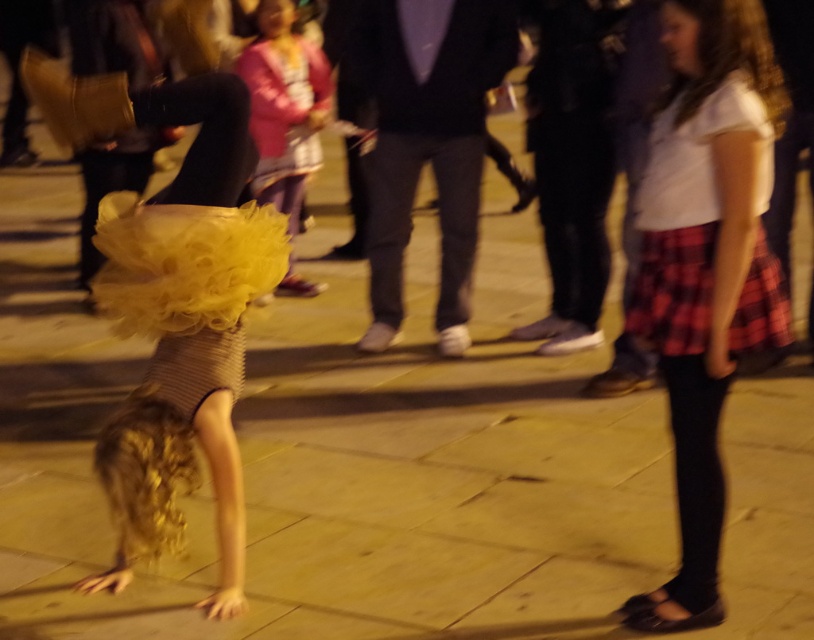
Who is more forward, (710, 488) or (768, 275)?

Point (768, 275) is in front.

Is white cotton shirt at upper right positioned in front of red plaid skirt at right?

Yes, it is in front of red plaid skirt at right.

Identify the location of white cotton shirt at upper right. (705, 268).

Between dark blue suit at center and red plaid skirt at right, which one is positioned higher?

Positioned higher is dark blue suit at center.

The height and width of the screenshot is (640, 814). Identify the location of dark blue suit at center. (427, 140).

Does point (414, 138) lie behind point (764, 307)?

Yes, it is behind point (764, 307).

Where is `dark blue suit at center`? Image resolution: width=814 pixels, height=640 pixels. dark blue suit at center is located at coordinates (427, 140).

Is white cotton shirt at upper right behind dark blue suit at center?

No, it is not.

Is point (655, 609) in front of point (467, 92)?

That is True.

Find the location of a particular element. This screenshot has width=814, height=640. white cotton shirt at upper right is located at coordinates (705, 268).